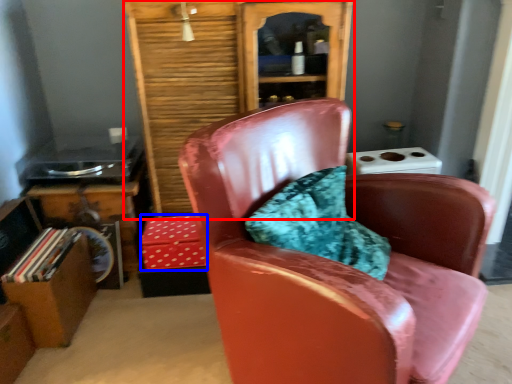
Question: Which of the following is the closest to the observer, bookcase (highlighted by a red box) or box (highlighted by a blue box)?

Choices:
 (A) bookcase
 (B) box

Answer: (A)